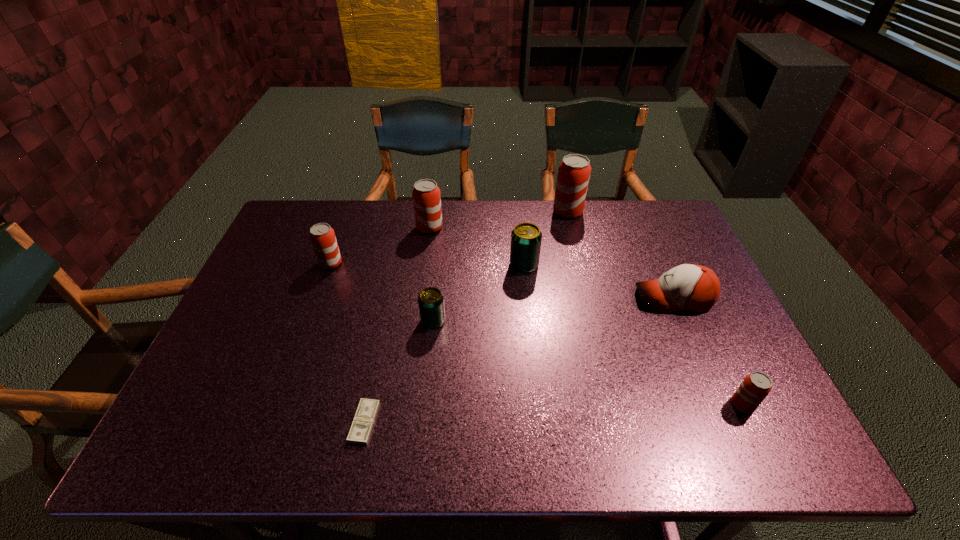
Locate an element on the screen. This screenshot has width=960, height=540. blank space that satisfies the following two spatial constraints: 1. on the front-facing side of the orange baseball cap; 2. on the right side of the nearest beer can is located at coordinates (720, 404).

You are a GUI agent. You are given a task and a screenshot of the screen. Output one action in this format:
    pyautogui.click(x=<x>, y=<y>)
    Task: Click on the free space that satisfies the following two spatial constraints: 1. on the front-facing side of the rightmost beer can; 2. on the left side of the orange baseball cap
    Image resolution: width=960 pixels, height=540 pixels.
    Given the screenshot: What is the action you would take?
    pyautogui.click(x=720, y=404)

Where is `vacant space that satisfies the following two spatial constraints: 1. on the front-facing side of the orange baseball cap; 2. on the right side of the smallest orange beer can`? Image resolution: width=960 pixels, height=540 pixels. vacant space that satisfies the following two spatial constraints: 1. on the front-facing side of the orange baseball cap; 2. on the right side of the smallest orange beer can is located at coordinates (720, 404).

Locate an element on the screen. vacant area in the image that satisfies the following two spatial constraints: 1. on the front-facing side of the baseball cap; 2. on the front side of the seventh object from right to left is located at coordinates (728, 422).

Find the location of a particular element. The width and height of the screenshot is (960, 540). vacant area that satisfies the following two spatial constraints: 1. on the back side of the money; 2. on the right side of the fourth object from right to left is located at coordinates (396, 265).

Where is `vacant position in the image that satisfies the following two spatial constraints: 1. on the front side of the leftmost beer can; 2. on the left side of the nearer green beer can`? Image resolution: width=960 pixels, height=540 pixels. vacant position in the image that satisfies the following two spatial constraints: 1. on the front side of the leftmost beer can; 2. on the left side of the nearer green beer can is located at coordinates (310, 321).